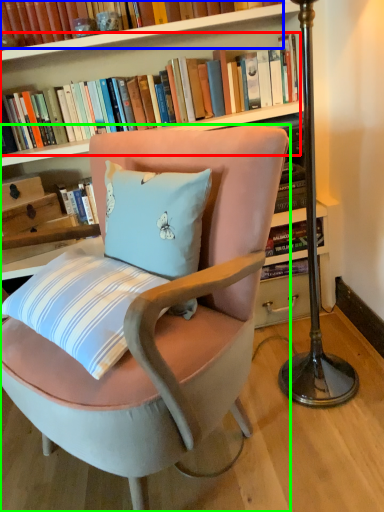
Question: Estimate the real-world distances between objects in this image. Which object is closer to book (highlighted by a red box), book (highlighted by a blue box) or chair (highlighted by a green box)?

Choices:
 (A) book
 (B) chair

Answer: (A)